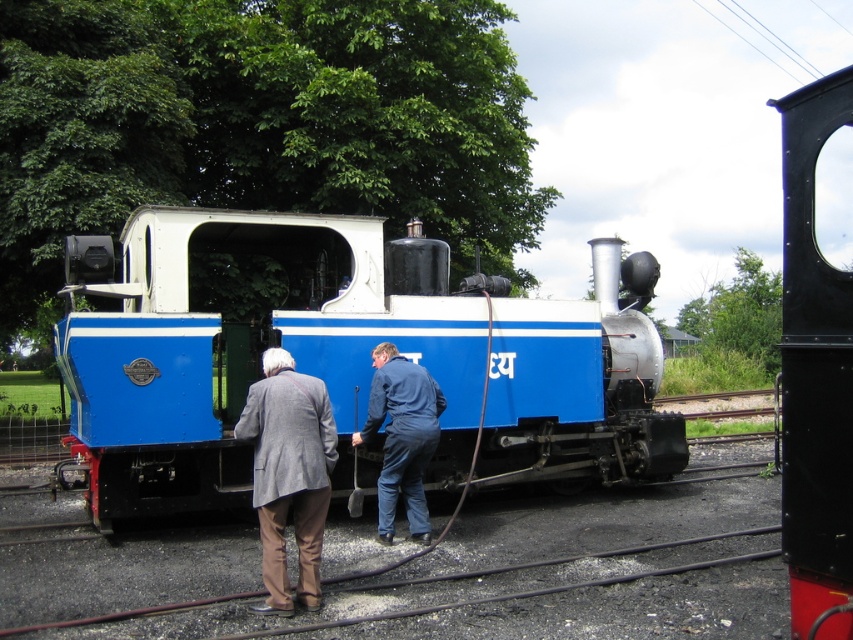
Does black metal door at upper right come behind gray woolen coat at center?

No, it is not.

Consider the image. Can you confirm if black metal door at upper right is shorter than gray woolen coat at center?

No, black metal door at upper right is not shorter than gray woolen coat at center.

What do you see at coordinates (815, 376) in the screenshot? This screenshot has height=640, width=853. I see `black metal door at upper right` at bounding box center [815, 376].

Where is `black metal door at upper right`? The height and width of the screenshot is (640, 853). black metal door at upper right is located at coordinates (815, 376).

Can you confirm if gray woolen coat at center is bigger than blue denim jumpsuit at center?

Yes.

Between gray woolen coat at center and blue denim jumpsuit at center, which one is positioned lower?

blue denim jumpsuit at center

This screenshot has height=640, width=853. Find the location of `gray woolen coat at center`. gray woolen coat at center is located at coordinates (289, 474).

Can you confirm if blue painted steel train at center is taller than blue denim jumpsuit at center?

Yes.

Who is lower down, blue painted steel train at center or blue denim jumpsuit at center?

blue denim jumpsuit at center

Which is behind, point (326, 246) or point (373, 348)?

The point (326, 246) is behind.

The height and width of the screenshot is (640, 853). Identify the location of blue painted steel train at center. (338, 356).